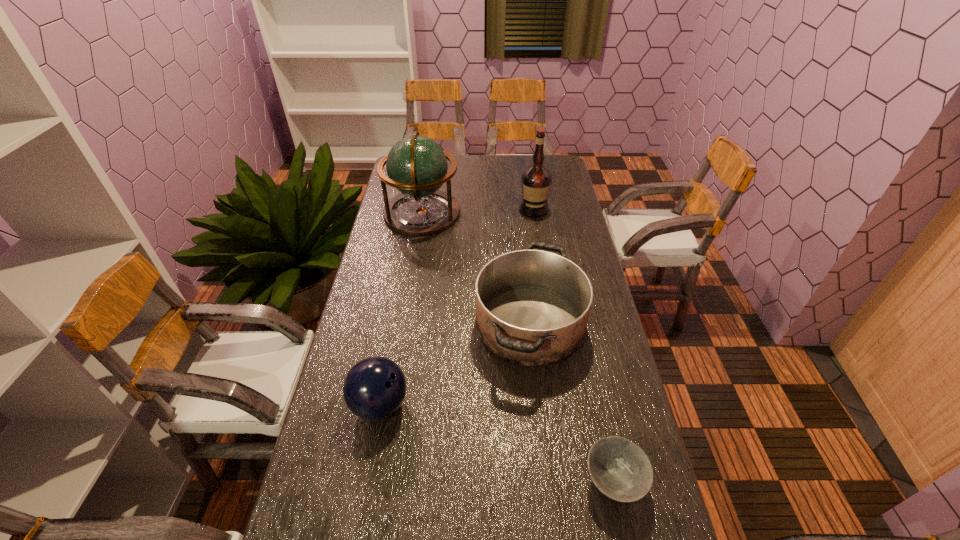
Image resolution: width=960 pixels, height=540 pixels. Identify the location of blank space that satisfies the following two spatial constraints: 1. on the surface of the liquor; 2. on the surface of the bowling ball near the finger holes. (564, 404).

Where is `blank area in the image that satisfies the following two spatial constraints: 1. on the surface of the liquor; 2. on the surface of the bowling ball near the finger holes`? This screenshot has height=540, width=960. blank area in the image that satisfies the following two spatial constraints: 1. on the surface of the liquor; 2. on the surface of the bowling ball near the finger holes is located at coordinates (564, 404).